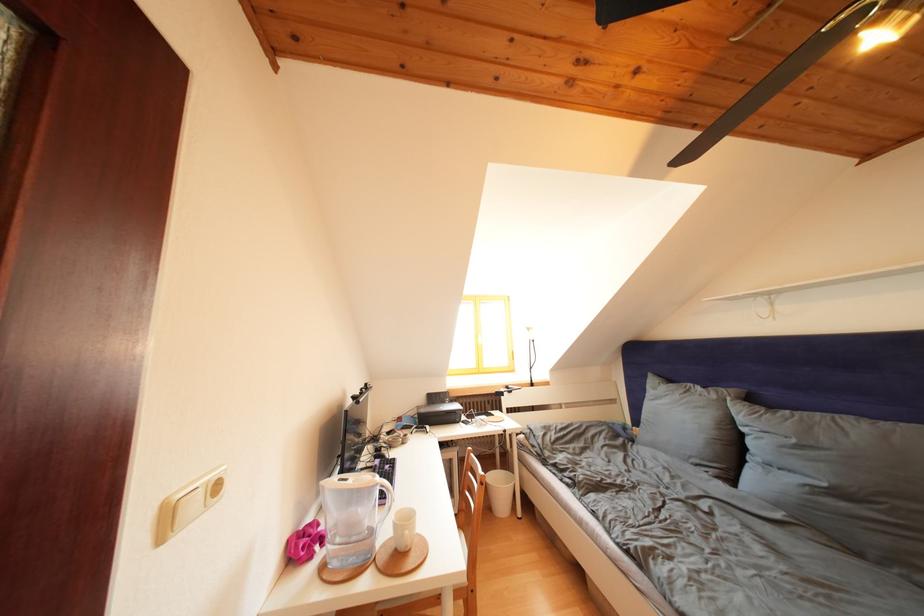
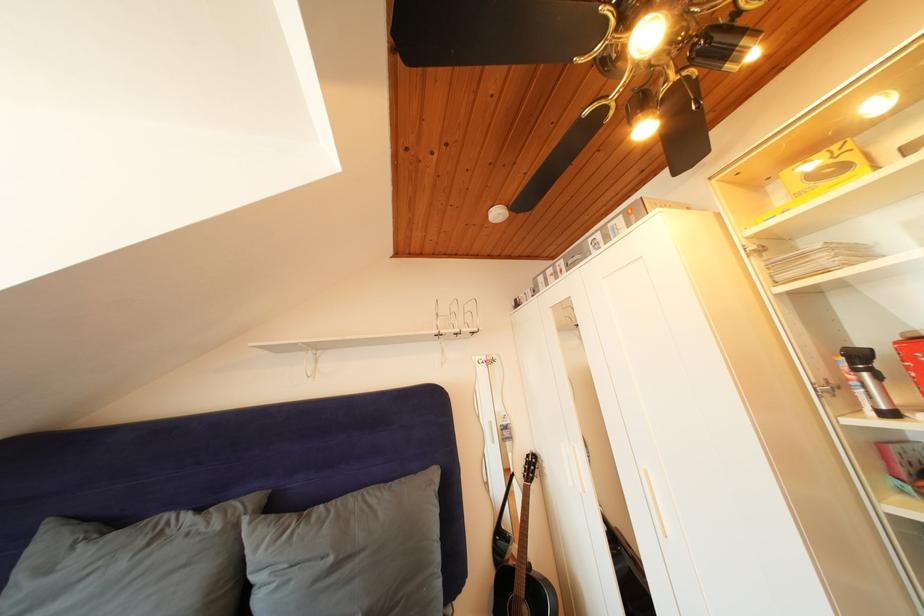
In the second image, find the point that corresponds to point 722,402 in the first image.

(225, 531)